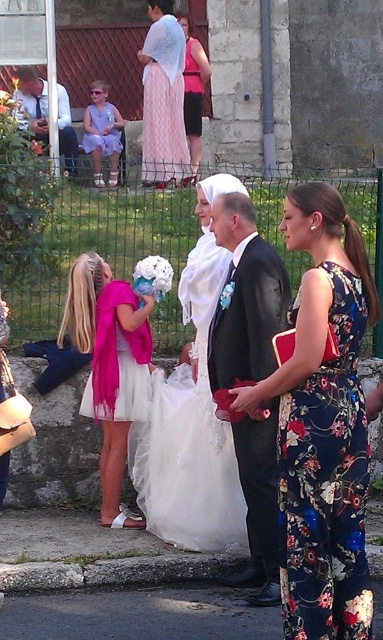
You are standing in the wedding scene and want to take a photo of the point at coordinates (340, 352). Your camera has a maximum focus range of 5 meters. Will the camera be able to focus on that point?

The distance of point (340, 352) from the viewer is 5.43 meters, which exceeds the camera maximum focus range of 5 meters. Therefore, the camera will not be able to focus on that point.

You are a photographer setting up for a group photo at the wedding. You need to position the pink satin dress at center and the matte purple dress at upper left in the same frame. Given that your camera has a maximum focus range of 8 meters, will both subjects be in focus?

The distance between the pink satin dress at center and the matte purple dress at upper left is 8.34 meters, which exceeds the camera maximum focus range of 8 meters. Therefore, both subjects cannot be in focus simultaneously.

You are planning to take a photo of the wedding guests. The photographer wants to ensure that both the pink satin dress at center and the matte purple dress at upper left are visible in the frame. Considering their sizes, which dress might require the photographer to adjust the camera angle to include it fully?

The matte purple dress at upper left requires adjusting the camera angle because it occupies more space than the pink satin dress at center.